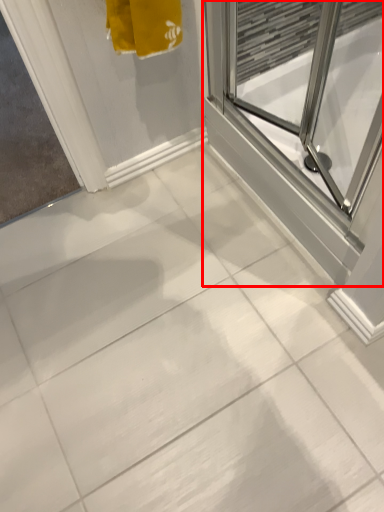
Question: From the image's perspective, what is the correct spatial positioning of screen door (annotated by the red box) in reference to window screen?

Choices:
 (A) above
 (B) below

Answer: (B)